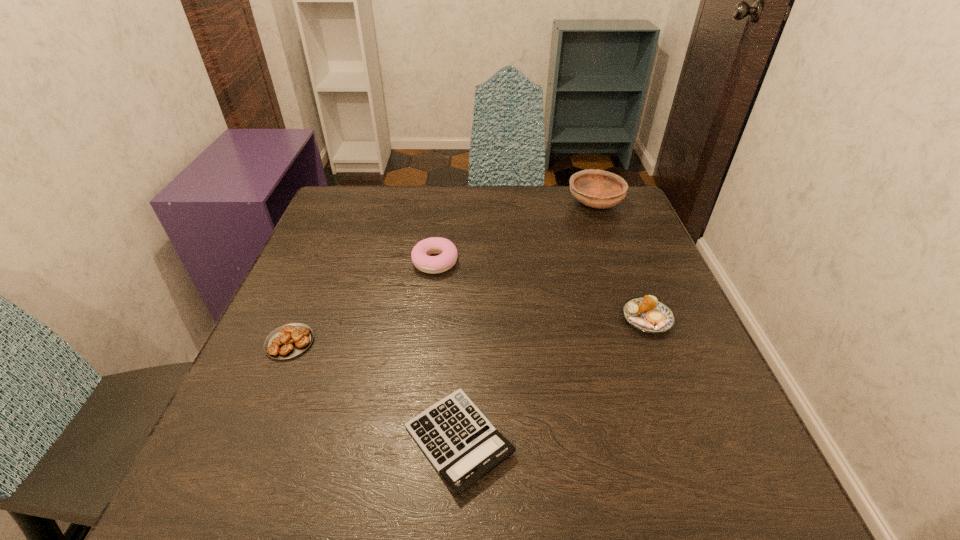
What are the coordinates of `object positioned at the far right corner` in the screenshot? It's located at (600, 189).

Find the location of a particular element. vacant space at the far edge of the desktop is located at coordinates (545, 190).

Where is `vacant region at the near edge of the desktop`? This screenshot has height=540, width=960. vacant region at the near edge of the desktop is located at coordinates (474, 511).

Identify the location of free location at the right edge. (620, 253).

This screenshot has height=540, width=960. I want to click on vacant area at the far left corner of the desktop, so click(354, 200).

You are a GUI agent. You are given a task and a screenshot of the screen. Output one action in this format:
    pyautogui.click(x=<x>, y=<y>)
    Task: Click on the free space between the calculator and the third tallest object
    
    Given the screenshot: What is the action you would take?
    pyautogui.click(x=553, y=379)

Where is `unoccupied area between the tallest object and the shortest object`? Image resolution: width=960 pixels, height=540 pixels. unoccupied area between the tallest object and the shortest object is located at coordinates (527, 321).

In order to click on vacant point located between the calculator and the farthest object in this screenshot , I will do click(x=527, y=321).

I want to click on free space between the rightmost pastry and the tallest object, so click(x=621, y=260).

Locate an element on the screen. free area in between the farthest pastry and the tallest object is located at coordinates (515, 232).